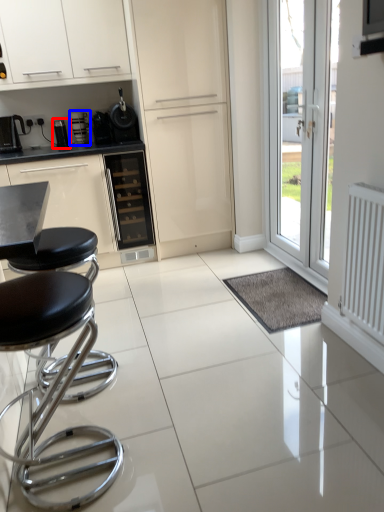
Question: Which of the following is the closest to the observer, appliance (highlighted by a red box) or coffee machine (highlighted by a blue box)?

Choices:
 (A) appliance
 (B) coffee machine

Answer: (B)